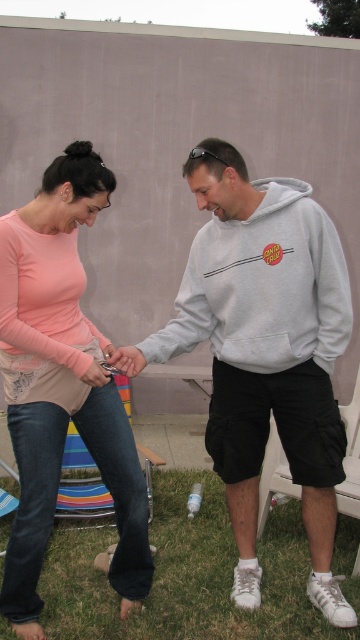
Who is taller, gray cotton sweatshirt at center or pink matte shirt at upper left?

Standing taller between the two is pink matte shirt at upper left.

Is gray cotton sweatshirt at center in front of pink matte shirt at upper left?

No, it is not.

What do you see at coordinates (264, 352) in the screenshot?
I see `gray cotton sweatshirt at center` at bounding box center [264, 352].

Locate an element on the screen. gray cotton sweatshirt at center is located at coordinates (264, 352).

Locate an element on the screen. gray cotton sweatshirt at center is located at coordinates (264, 352).

Who is more forward, (282, 193) or (358, 365)?

Point (282, 193) is in front.

The height and width of the screenshot is (640, 360). I want to click on gray cotton sweatshirt at center, so click(x=264, y=352).

Does pink matte shirt at upper left have a larger size compared to striped fabric chair at lower left?

Indeed, pink matte shirt at upper left has a larger size compared to striped fabric chair at lower left.

Is point (78, 346) closer to viewer compared to point (83, 442)?

Yes.

Identify the location of pink matte shirt at upper left. The height and width of the screenshot is (640, 360). (61, 385).